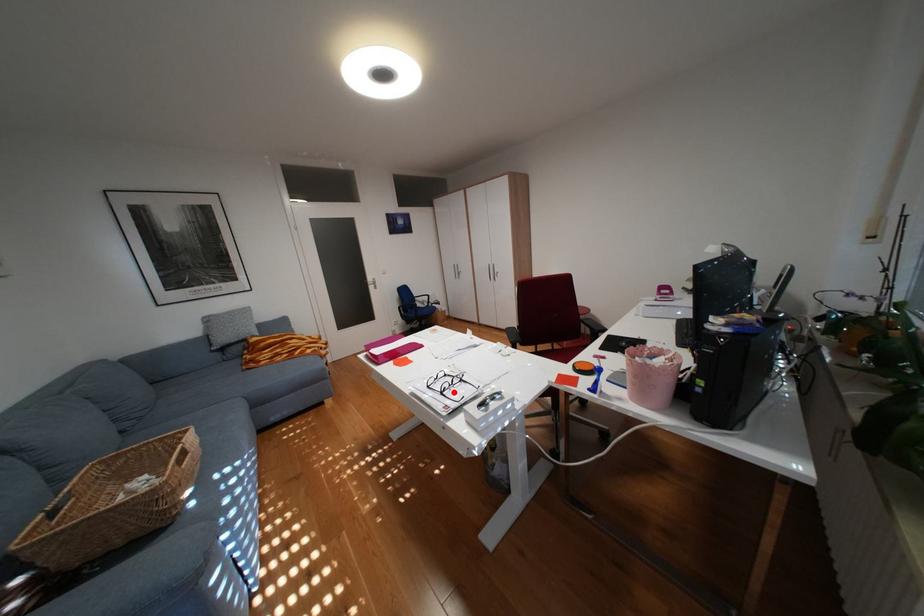
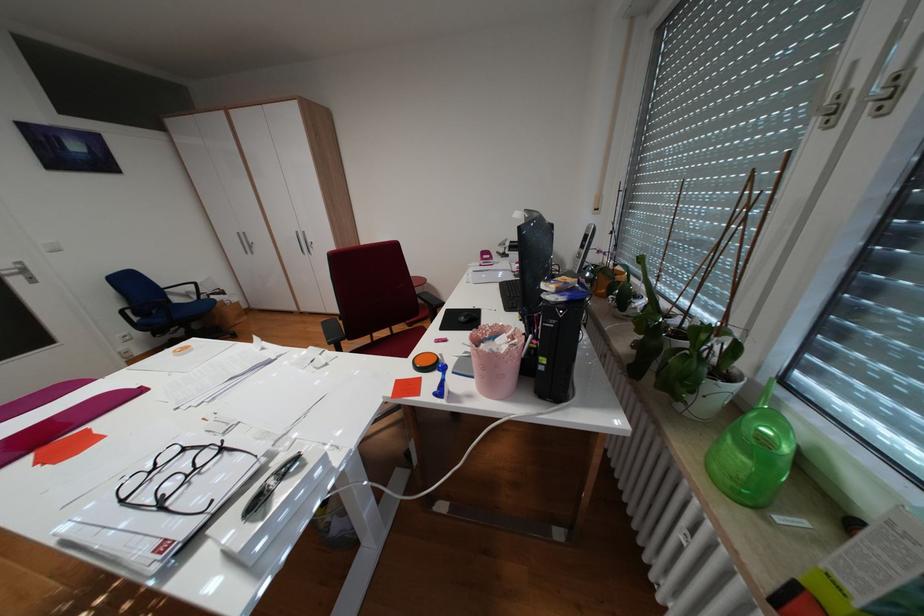
In the second image, find the point that corresponds to the highlighted location in the first image.

(173, 505)